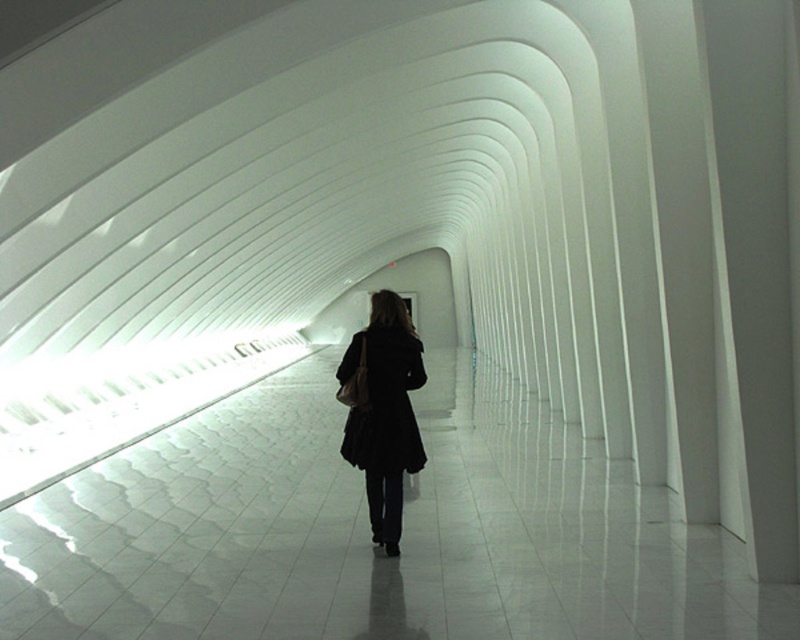
Question: Does white glossy floor at center have a larger size compared to black matte coat at center?

Choices:
 (A) yes
 (B) no

Answer: (A)

Question: Is white glossy floor at center wider than black matte coat at center?

Choices:
 (A) yes
 (B) no

Answer: (A)

Question: Which point is farther to the camera?

Choices:
 (A) white glossy floor at center
 (B) black matte coat at center

Answer: (B)

Question: Which object appears farthest from the camera in this image?

Choices:
 (A) black matte coat at center
 (B) white glossy floor at center

Answer: (A)

Question: Is white glossy floor at center above black matte coat at center?

Choices:
 (A) yes
 (B) no

Answer: (B)